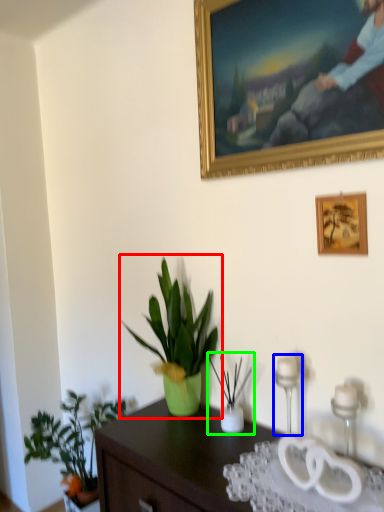
Question: Which object is positioned farthest from houseplant (highlighted by a red box)? Select from candle holder (highlighted by a blue box) and houseplant (highlighted by a green box).

Choices:
 (A) candle holder
 (B) houseplant

Answer: (A)